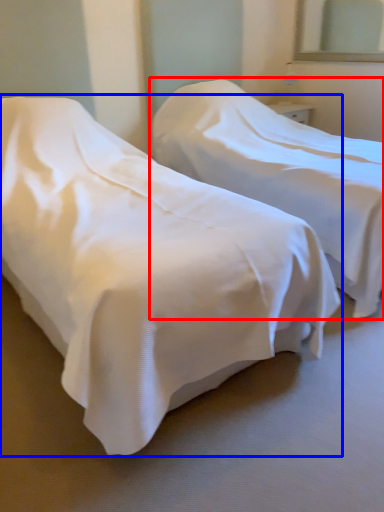
Question: Which object appears farthest to the camera in this image, bed (highlighted by a red box) or bed (highlighted by a blue box)?

Choices:
 (A) bed
 (B) bed

Answer: (A)